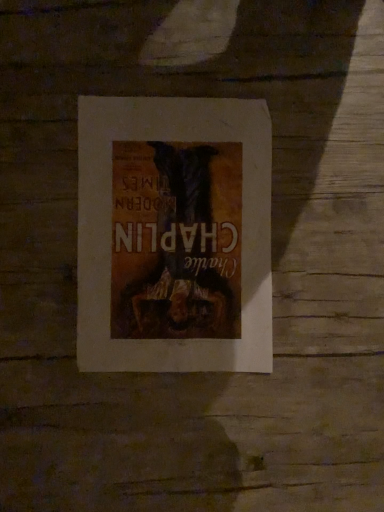
At what (x,y) coordinates should I click in order to perform the action: click on free spot above matte paper poster at center (from a real-world perspective). Please return your answer as a coordinate pair (x, y). Looking at the image, I should click on (177, 225).